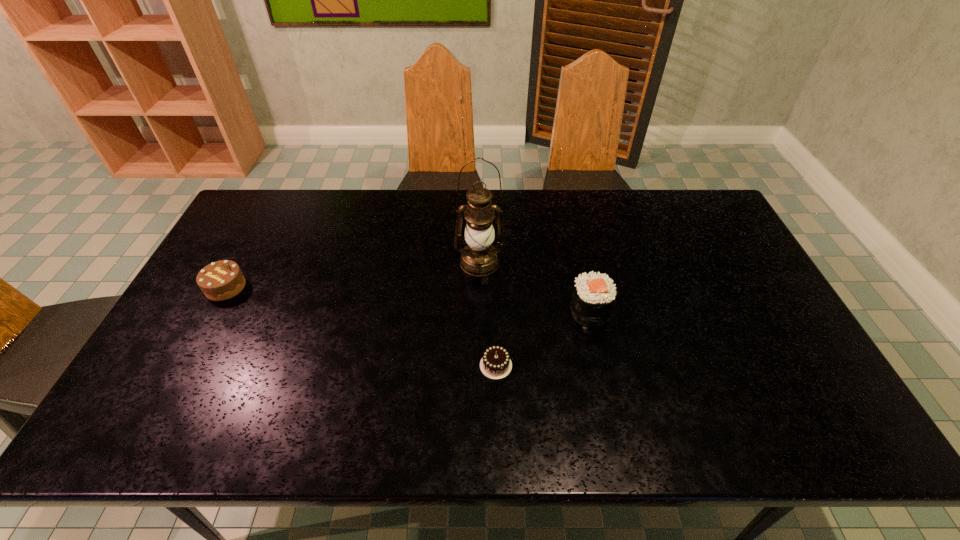
The image size is (960, 540). Find the location of `vacant space located 0.060m on the back of the nearer chocolate cake`. vacant space located 0.060m on the back of the nearer chocolate cake is located at coordinates (495, 333).

I want to click on object situated at the left edge, so click(x=221, y=280).

Identify the location of vacant space at the far edge of the desktop. This screenshot has width=960, height=540. (341, 213).

This screenshot has height=540, width=960. Identify the location of vacant space at the near edge of the desktop. (542, 411).

This screenshot has height=540, width=960. In the image, there is a desktop. What are the coordinates of `free space at the left edge` in the screenshot? It's located at (178, 363).

Identify the location of free location at the right edge. (713, 296).

Image resolution: width=960 pixels, height=540 pixels. I want to click on vacant region at the far left corner, so click(249, 218).

Where is `vacant region at the far right corner of the desktop`? The width and height of the screenshot is (960, 540). vacant region at the far right corner of the desktop is located at coordinates (701, 202).

Where is `empty location between the shorter chocolate cake and the rightmost object`? empty location between the shorter chocolate cake and the rightmost object is located at coordinates (542, 338).

This screenshot has height=540, width=960. Find the location of `vacant area between the rightmost object and the shortest object`. vacant area between the rightmost object and the shortest object is located at coordinates (542, 338).